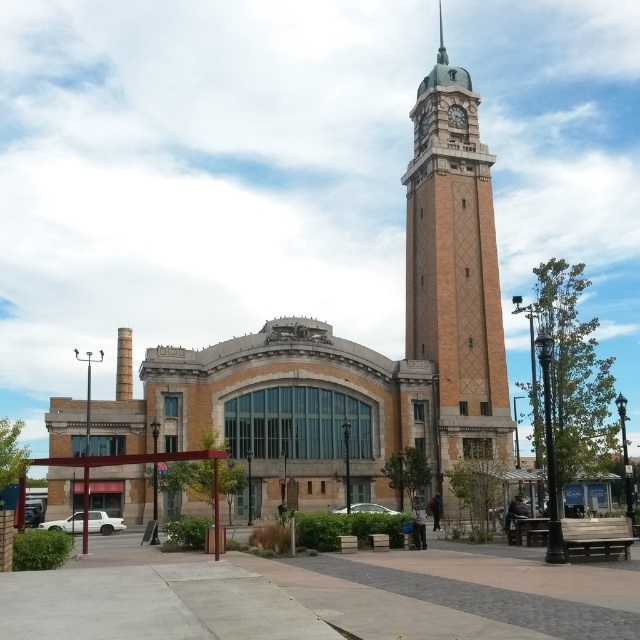
You are standing in front of the historic building and want to walk towards the two points marked in the image. Which point would you reach first, point [451,164] or point [452,109]?

You would reach point [451,164] first because it is closer to the viewer than point [452,109].

You are an architect examining the building layout. Which of the two brick structures, the brown brick clock tower at upper right or the brick clock tower at upper center, is positioned higher up in the image?

The brick clock tower at upper center is positioned higher up in the image than the brown brick clock tower at upper right, as the brown brick clock tower at upper right is located below it.